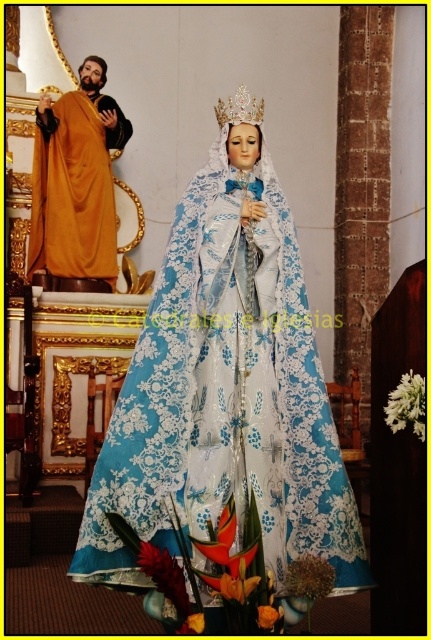
Is golden draped robe at left above pearl-like crown at center?

No.

Does point (108, 193) lie behind point (256, 112)?

Yes.

The image size is (431, 640). I want to click on golden draped robe at left, so click(75, 180).

Does lace fabric statue at center appear under pearl-like crown at center?

Indeed, lace fabric statue at center is positioned under pearl-like crown at center.

Can you confirm if lace fabric statue at center is smaller than pearl-like crown at center?

Yes.

Does point (315, 358) come behind point (246, 93)?

No, it is not.

The image size is (431, 640). In order to click on lace fabric statue at center in this screenshot , I will do `click(225, 388)`.

Between lace fabric statue at center and golden draped robe at left, which one has less height?

With less height is golden draped robe at left.

Does point (146, 420) come farther from viewer compared to point (124, 125)?

No, it is not.

I want to click on lace fabric statue at center, so click(x=225, y=388).